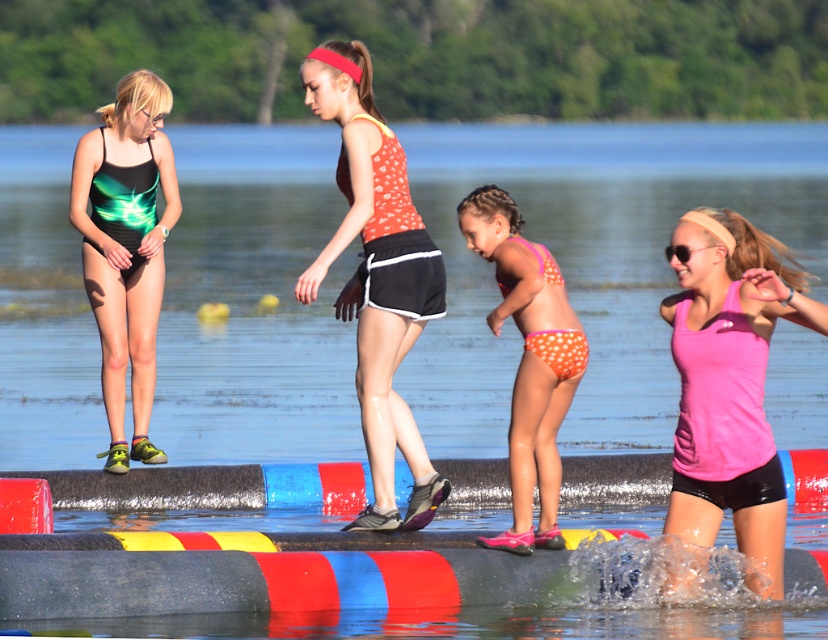
Is point (728, 456) behind point (130, 216)?

No, it is not.

At what (x,y) coordinates should I click in order to perform the action: click on pink matte tank top at center. Please return your answer as a coordinate pair (x, y). This screenshot has width=828, height=640. Looking at the image, I should click on (729, 385).

Can you confirm if orange dotted tank top at center is taller than orange polka dot bikini at center?

Correct, orange dotted tank top at center is much taller as orange polka dot bikini at center.

Is orange dotted tank top at center positioned at the back of orange polka dot bikini at center?

Yes, it is.

The width and height of the screenshot is (828, 640). I want to click on orange dotted tank top at center, so click(x=378, y=276).

You are a GUI agent. You are given a task and a screenshot of the screen. Output one action in this format:
    pyautogui.click(x=<x>, y=<y>)
    Task: Click on the orange dotted tank top at center
    
    Given the screenshot: What is the action you would take?
    pyautogui.click(x=378, y=276)

Between orange dotted tank top at center and green iridescent swimsuit at left, which one is positioned higher?

Positioned higher is orange dotted tank top at center.

Does orange dotted tank top at center have a greater width compared to green iridescent swimsuit at left?

Incorrect, orange dotted tank top at center's width does not surpass green iridescent swimsuit at left's.

The width and height of the screenshot is (828, 640). I want to click on orange dotted tank top at center, so click(378, 276).

The width and height of the screenshot is (828, 640). Identify the location of orange dotted tank top at center. (378, 276).